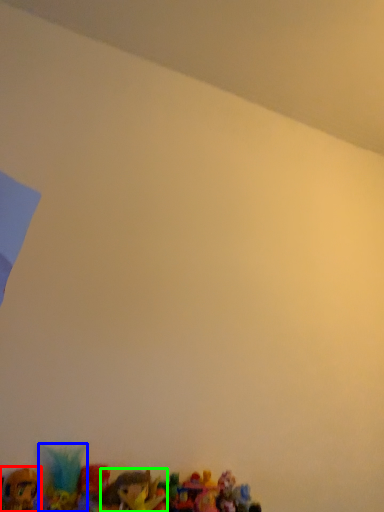
Question: Estimate the real-world distances between objects in this image. Which object is farther from toy (highlighted by a red box), toy (highlighted by a blue box) or toy (highlighted by a green box)?

Choices:
 (A) toy
 (B) toy

Answer: (B)